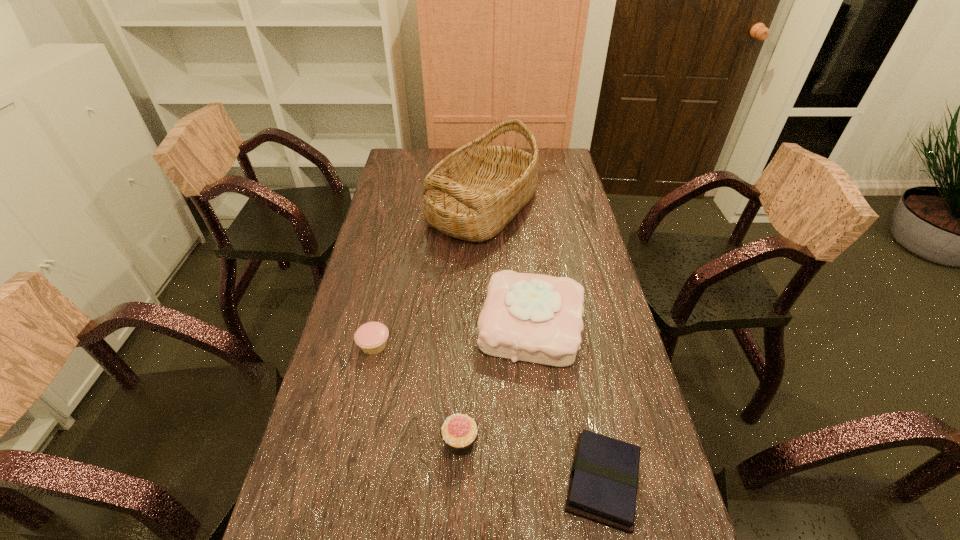
Identify the location of the tallest object. (472, 194).

Image resolution: width=960 pixels, height=540 pixels. I want to click on basket, so click(472, 194).

Locate an element on the screen. This screenshot has width=960, height=540. cake is located at coordinates (537, 318).

The width and height of the screenshot is (960, 540). Find the location of `the right cupcake`. the right cupcake is located at coordinates (459, 431).

Locate an element on the screen. This screenshot has width=960, height=540. the nearer cupcake is located at coordinates (459, 431).

Where is `the fourth tallest object`? This screenshot has height=540, width=960. the fourth tallest object is located at coordinates coord(371,337).

You are a GUI agent. You are given a task and a screenshot of the screen. Output one action in this format:
    pyautogui.click(x=<x>, y=<y>)
    Task: Click on the leftmost object
    
    Given the screenshot: What is the action you would take?
    pyautogui.click(x=371, y=337)

What are the coordinates of `the shortest object` in the screenshot? It's located at (603, 485).

You are a GUI agent. You are given a task and a screenshot of the screen. Output one action in this format:
    pyautogui.click(x=<x>, y=<y>)
    Task: Click on the vacant space located on the right of the basket
    This screenshot has height=540, width=960.
    Given the screenshot: What is the action you would take?
    561,207

I want to click on free region located on the front of the cake, so tap(554, 539).